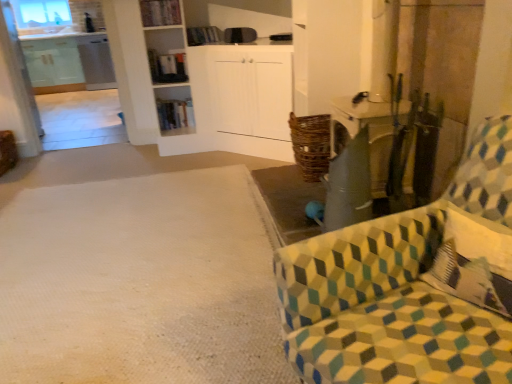
Question: Can you confirm if patterned fabric chair at right is shorter than wooden bookshelf at center, marked as the 1th shelf in a back-to-front arrangement?

Choices:
 (A) yes
 (B) no

Answer: (B)

Question: Is patterned fabric chair at right at the left side of wooden bookshelf at center, which appears as the first shelf when ordered from the bottom?

Choices:
 (A) yes
 (B) no

Answer: (B)

Question: From the image's perspective, is patterned fabric chair at right over wooden bookshelf at center, which appears as the first shelf when ordered from the bottom?

Choices:
 (A) yes
 (B) no

Answer: (B)

Question: Considering the relative sizes of patterned fabric chair at right and wooden bookshelf at center, the second shelf positioned from the top, in the image provided, is patterned fabric chair at right bigger than wooden bookshelf at center, the second shelf positioned from the top,?

Choices:
 (A) no
 (B) yes

Answer: (B)

Question: Considering the relative sizes of patterned fabric chair at right and wooden bookshelf at center, the second shelf positioned from the top, in the image provided, is patterned fabric chair at right wider than wooden bookshelf at center, the second shelf positioned from the top,?

Choices:
 (A) yes
 (B) no

Answer: (A)

Question: Is transparent glass window at upper left to the left or to the right of wooden bookshelf at upper center, which ranks as the 2th shelf in bottom-to-top order, in the image?

Choices:
 (A) left
 (B) right

Answer: (A)

Question: Is transparent glass window at upper left taller or shorter than wooden bookshelf at upper center, which ranks as the 2th shelf in bottom-to-top order?

Choices:
 (A) tall
 (B) short

Answer: (A)

Question: Looking at their shapes, would you say transparent glass window at upper left is wider or thinner than wooden bookshelf at upper center, acting as the first shelf starting from the top?

Choices:
 (A) wide
 (B) thin

Answer: (A)

Question: In the image, is transparent glass window at upper left positioned in front of or behind wooden bookshelf at upper center, positioned as the first shelf in front-to-back order?

Choices:
 (A) front
 (B) behind

Answer: (B)

Question: Is white textured carpet at lower left in front of or behind transparent glass window at upper left in the image?

Choices:
 (A) front
 (B) behind

Answer: (A)

Question: From a real-world perspective, is white textured carpet at lower left physically located above or below transparent glass window at upper left?

Choices:
 (A) below
 (B) above

Answer: (A)

Question: Is white textured carpet at lower left inside or outside of transparent glass window at upper left?

Choices:
 (A) inside
 (B) outside

Answer: (B)

Question: From the image's perspective, is white textured carpet at lower left above or below transparent glass window at upper left?

Choices:
 (A) above
 (B) below

Answer: (B)

Question: In the image, is wooden bookshelf at center, marked as the 1th shelf in a back-to-front arrangement, positioned in front of or behind white textured carpet at lower left?

Choices:
 (A) behind
 (B) front

Answer: (A)

Question: Is wooden bookshelf at center, which appears as the first shelf when ordered from the bottom, wider or thinner than white textured carpet at lower left?

Choices:
 (A) thin
 (B) wide

Answer: (A)